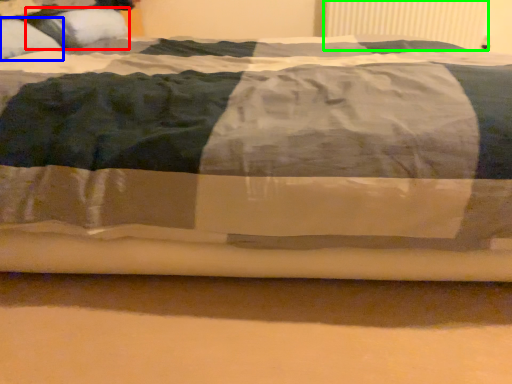
Question: Considering the real-world distances, which object is farthest from pillow (highlighted by a red box)? pillow (highlighted by a blue box) or radiator (highlighted by a green box)?

Choices:
 (A) pillow
 (B) radiator

Answer: (B)